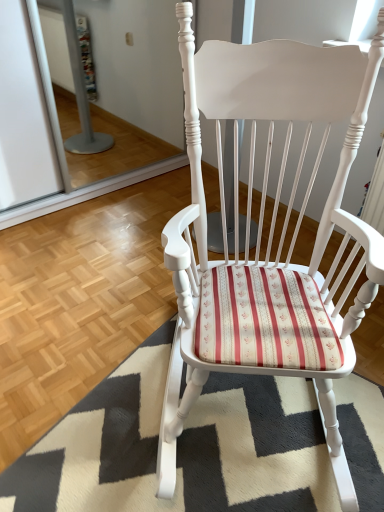
Identify the location of free spot above white textured rug at center (from a real-world perspective). The width and height of the screenshot is (384, 512). (226, 440).